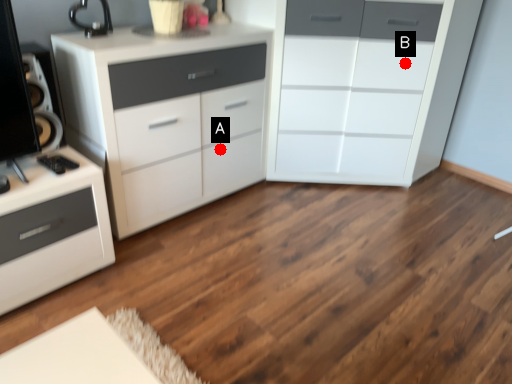
Question: Two points are circled on the image, labeled by A and B beside each circle. Which point is closer to the camera taking this photo?

Choices:
 (A) A is closer
 (B) B is closer

Answer: (B)